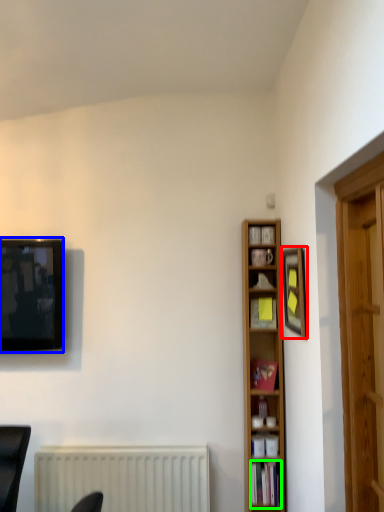
Question: Based on their relative distances, which object is nearer to picture frame (highlighted by a red box)? Choose from television (highlighted by a blue box) and book (highlighted by a green box).

Choices:
 (A) television
 (B) book

Answer: (B)